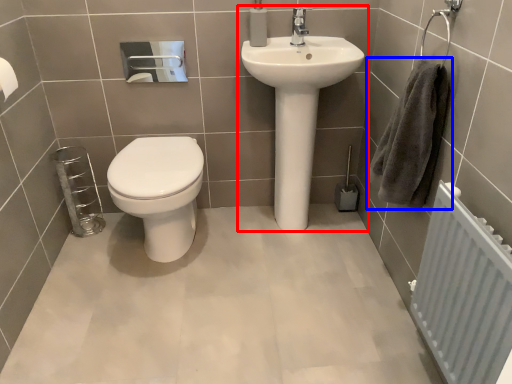
Question: Which point is further to the camera, sink (highlighted by a red box) or hand towel (highlighted by a blue box)?

Choices:
 (A) sink
 (B) hand towel

Answer: (A)